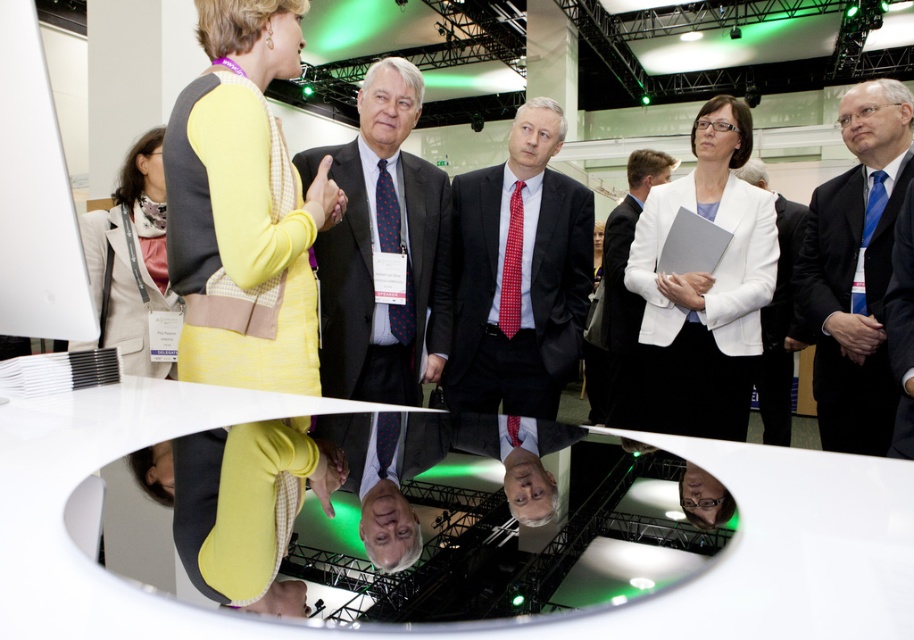
In the scene shown: Is the position of red dotted tie at center more distant than that of white fabric suit at center?

No, it is in front of white fabric suit at center.

Measure the distance between point (576, 346) and camera.

A distance of 6.84 feet exists between point (576, 346) and camera.

Locate an element on the screen. red dotted tie at center is located at coordinates (518, 273).

Is red dotted tie at center bigger than dark suit at center?

Incorrect, red dotted tie at center is not larger than dark suit at center.

Between red dotted tie at center and dark suit at center, which one is positioned higher?

Positioned higher is dark suit at center.

This screenshot has width=914, height=640. Find the location of `red dotted tie at center`. red dotted tie at center is located at coordinates (518, 273).

Where is `red dotted tie at center`? The image size is (914, 640). red dotted tie at center is located at coordinates click(518, 273).

Who is more forward, (x=558, y=291) or (x=614, y=369)?

Point (x=558, y=291) is in front.

Which is below, red dotted tie at center or white matte business suit at center?

white matte business suit at center is below.

Identify the location of red dotted tie at center. (518, 273).

The width and height of the screenshot is (914, 640). What are the coordinates of `red dotted tie at center` in the screenshot? It's located at (518, 273).